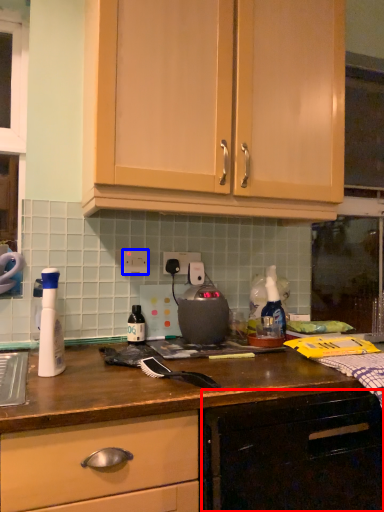
Question: Which of the following is the farthest to the observer, cabinetry (highlighted by a red box) or electric outlet (highlighted by a blue box)?

Choices:
 (A) cabinetry
 (B) electric outlet

Answer: (B)